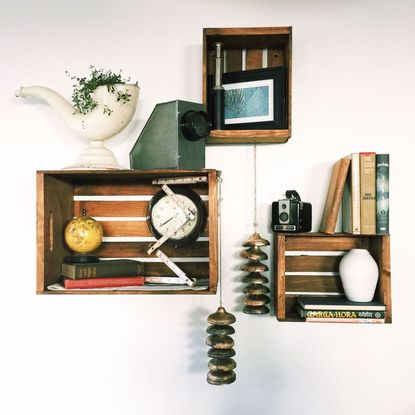
In order to click on vase in this screenshot , I will do `click(358, 271)`.